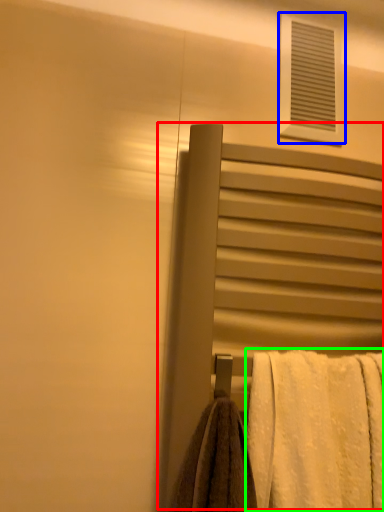
Question: Which object is the farthest from screen door (highlighted by a red box)? Choose among these: window (highlighted by a blue box) or towel (highlighted by a green box).

Choices:
 (A) window
 (B) towel

Answer: (A)